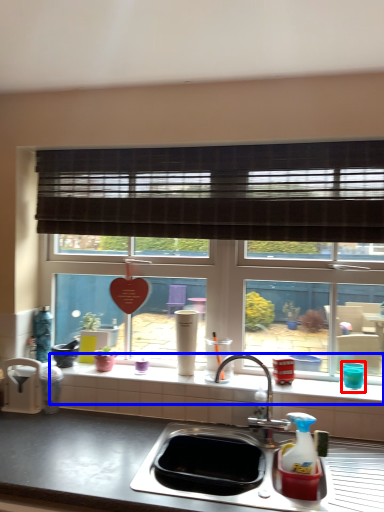
Question: Among these objects, which one is farthest to the camera, appliance (highlighted by a red box) or window sill (highlighted by a blue box)?

Choices:
 (A) appliance
 (B) window sill

Answer: (A)